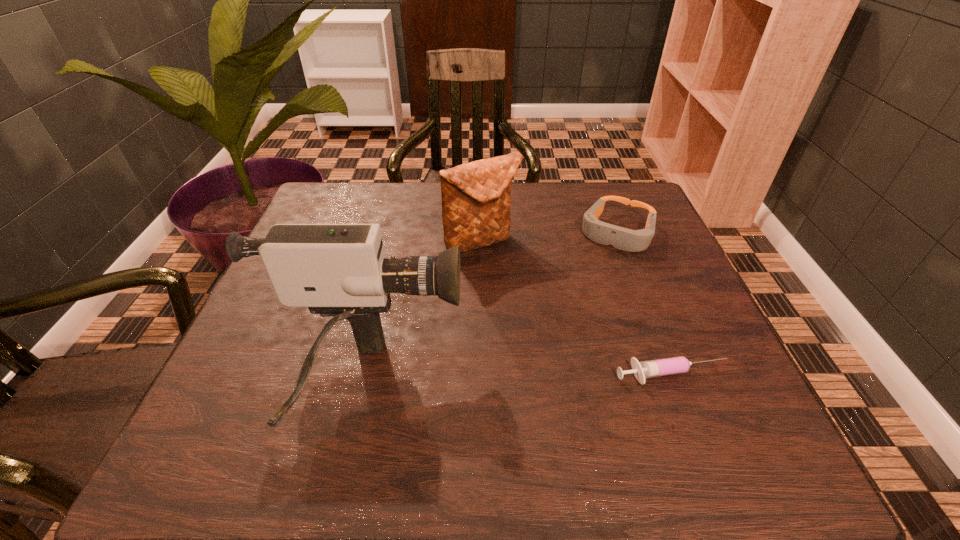
Identify the location of blank space located 0.080m on the front and back of the second shortest object. This screenshot has height=540, width=960. (598, 275).

At what (x,y) coordinates should I click in order to perform the action: click on free point located on the front and back of the second shortest object. Please return your answer as a coordinate pair (x, y). Looking at the image, I should click on (600, 273).

What are the coordinates of `clutch bag situated at the far edge` in the screenshot? It's located at (476, 196).

At what (x,y) coordinates should I click in order to perform the action: click on goggles that is positioned at the far edge. Please return your answer as a coordinate pair (x, y). The image size is (960, 540). Looking at the image, I should click on (604, 233).

Where is `camcorder that is at the near edge`? camcorder that is at the near edge is located at coordinates (336, 270).

In order to click on syringe that is at the near edge in this screenshot , I will do click(x=675, y=365).

Where is `object that is at the left edge`? object that is at the left edge is located at coordinates (336, 270).

Locate an element on the screen. The width and height of the screenshot is (960, 540). syringe that is at the right edge is located at coordinates (675, 365).

At what (x,y) coordinates should I click in order to perform the action: click on goggles at the right edge. Please return your answer as a coordinate pair (x, y). Image resolution: width=960 pixels, height=540 pixels. Looking at the image, I should click on (604, 233).

Locate an element on the screen. The height and width of the screenshot is (540, 960). object that is at the near left corner is located at coordinates (336, 270).